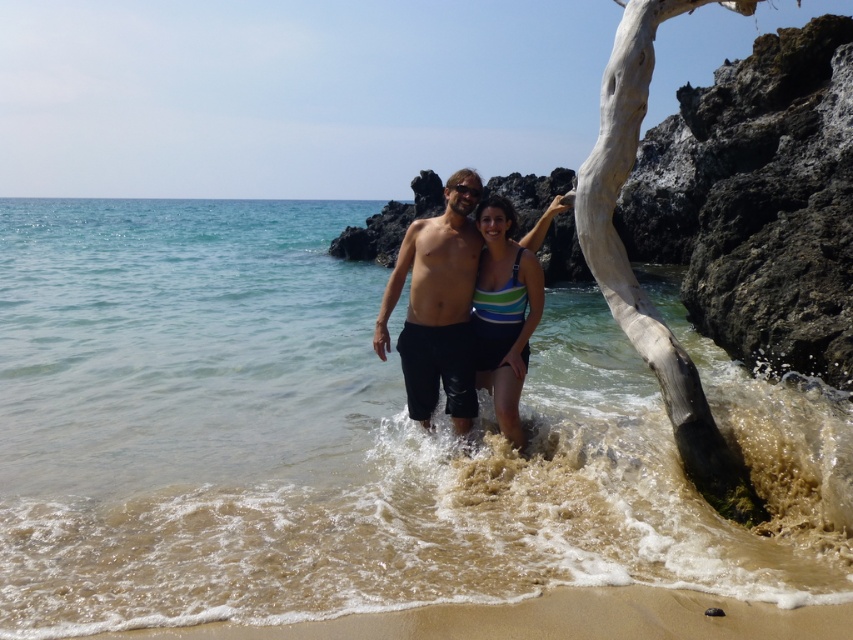
You are a photographer trying to capture the striped fabric swimsuit at center and the white textured driftwood at center in the same frame. Which object should you focus on first if you want to ensure both are in focus?

The white textured driftwood at center is taller than the striped fabric swimsuit at center, so focusing on the taller driftwood first would help ensure both are in focus as it occupies more space in the frame.

In the scene shown: You are a photographer planning to take a photo of the clear water at center and the matte black shorts at center. Based on their positions, which object appears taller in the image?

The clear water at center appears taller than the matte black shorts at center in the image.